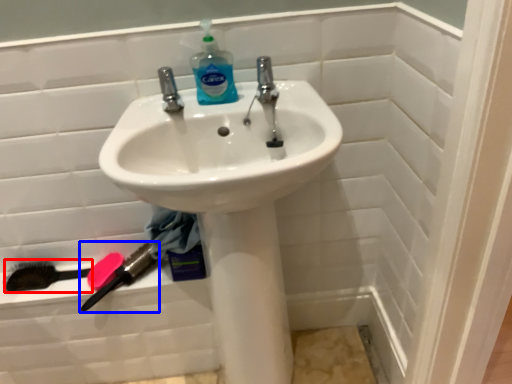
Question: Which point is further to the camera, brush (highlighted by a red box) or brush (highlighted by a blue box)?

Choices:
 (A) brush
 (B) brush

Answer: (A)